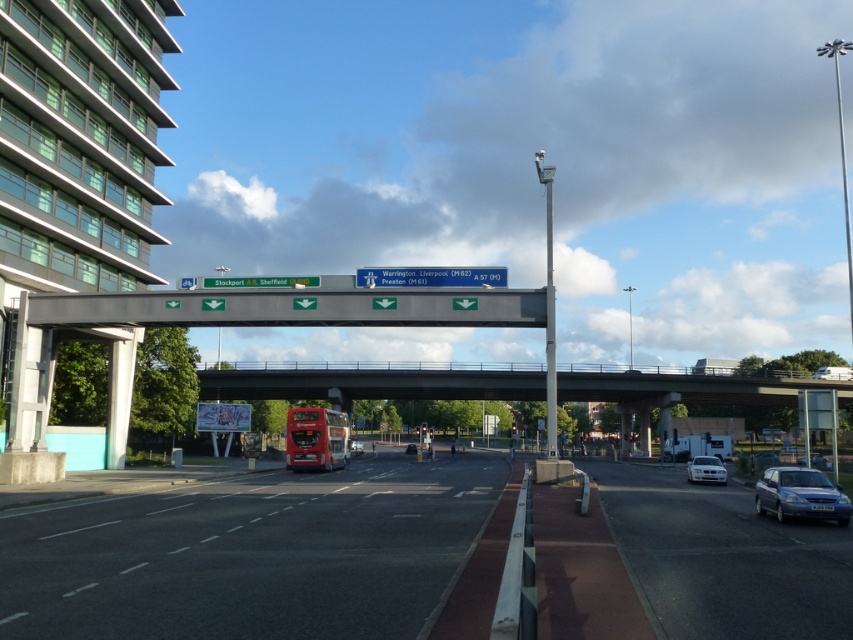
Question: Is blue plastic sign at center in front of metallic silver car at lower right?

Choices:
 (A) no
 (B) yes

Answer: (B)

Question: Can you confirm if metallic green sign at upper center is wider than white glossy sedan at lower right?

Choices:
 (A) yes
 (B) no

Answer: (A)

Question: Which object is positioned farthest from the white glossy sedan at lower right?

Choices:
 (A) metallic silver car at lower right
 (B) black asphalt highway at center
 (C) metallic green sign at upper center

Answer: (C)

Question: Which object is closer to the camera taking this photo?

Choices:
 (A) metallic green sign at upper center
 (B) metallic blue sedan at lower right
 (C) black asphalt highway at center

Answer: (C)

Question: Which point appears farthest from the camera in this image?

Choices:
 (A) pyautogui.click(x=776, y=500)
 (B) pyautogui.click(x=306, y=280)

Answer: (B)

Question: Is black asphalt highway at center wider than metallic blue sedan at lower right?

Choices:
 (A) yes
 (B) no

Answer: (A)